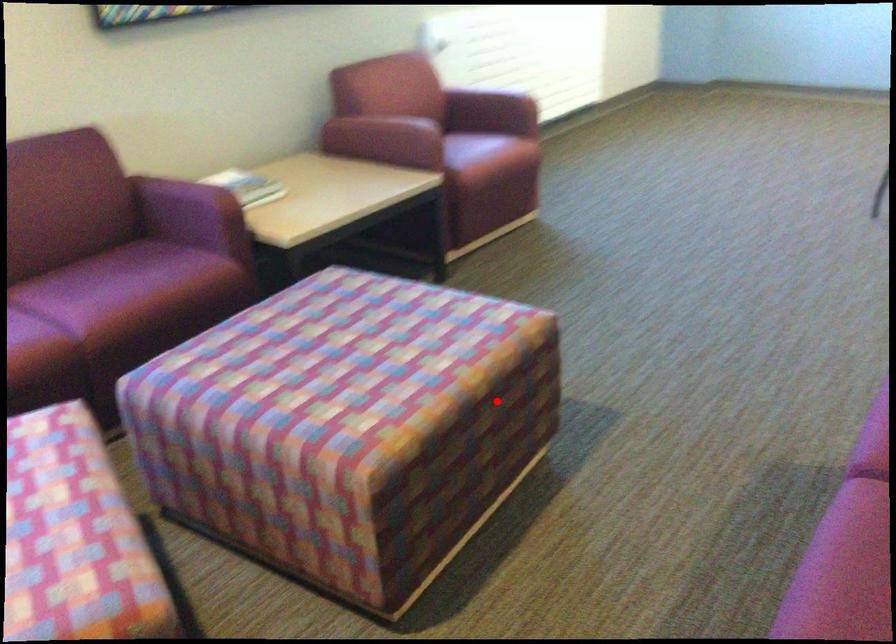
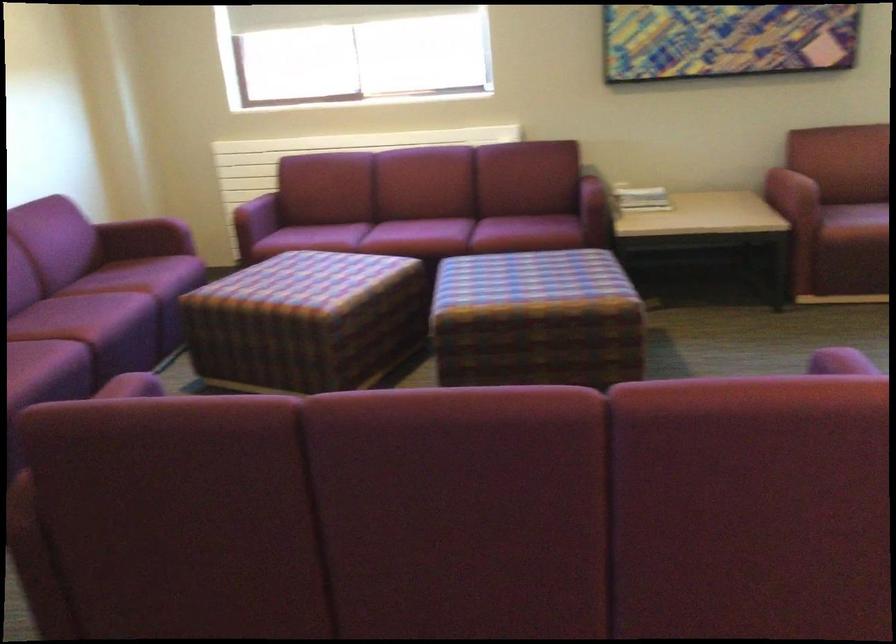
Question: I am providing you with two images of the same scene from different viewpoints. Image1 has a red point marked. In image2, the corresponding 3D location appears at what relative position? Reply with the corresponding letter.

Choices:
 (A) Closer
 (B) Farther

Answer: (B)